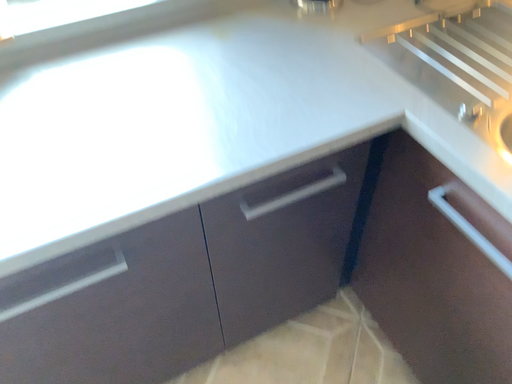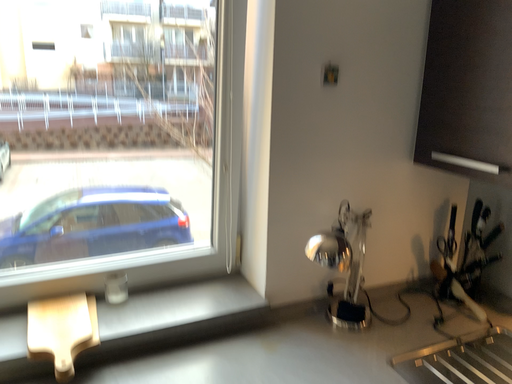
Question: How did the camera likely rotate when shooting the video?

Choices:
 (A) rotated upward
 (B) rotated downward

Answer: (A)